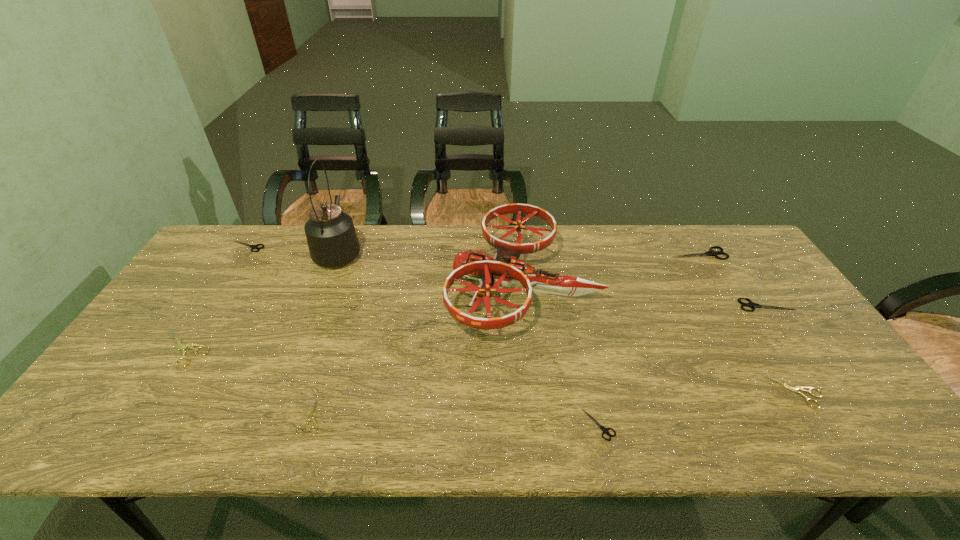
Image resolution: width=960 pixels, height=540 pixels. In order to click on the rightmost beige shears in this screenshot , I will do click(795, 389).

Locate an element on the screen. This screenshot has height=540, width=960. the third black shears from right to left is located at coordinates (605, 430).

This screenshot has height=540, width=960. What are the coordinates of `the smallest black shears` in the screenshot? It's located at pos(605,430).

Find the location of a particular element. This screenshot has height=540, width=960. the shortest object is located at coordinates (310, 417).

This screenshot has height=540, width=960. I want to click on the second beige shears from left to right, so click(310, 417).

Identify the location of free spot located on the right of the red drone. This screenshot has height=540, width=960. (713, 285).

Where is `vacant position located on the front of the tallest shears`? The width and height of the screenshot is (960, 540). vacant position located on the front of the tallest shears is located at coordinates (732, 308).

I want to click on free spot located on the back of the sixth shortest shears, so click(x=743, y=272).

Image resolution: width=960 pixels, height=540 pixels. Find the location of `free location located on the right of the third biggest black shears`. free location located on the right of the third biggest black shears is located at coordinates (360, 246).

Locate an element on the screen. Image resolution: width=960 pixels, height=540 pixels. vacant space situated 0.110m on the front of the biggest beige shears is located at coordinates (147, 407).